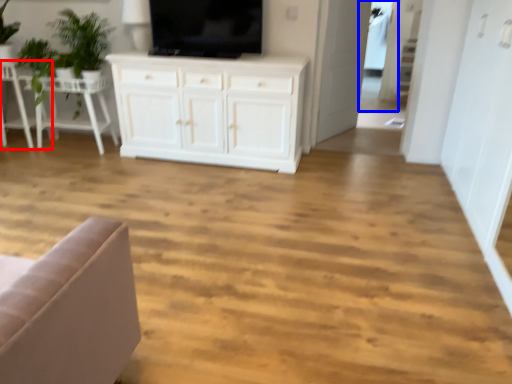
Question: Which object appears farthest to the camera in this image, chair (highlighted by a red box) or glass door (highlighted by a blue box)?

Choices:
 (A) chair
 (B) glass door

Answer: (B)